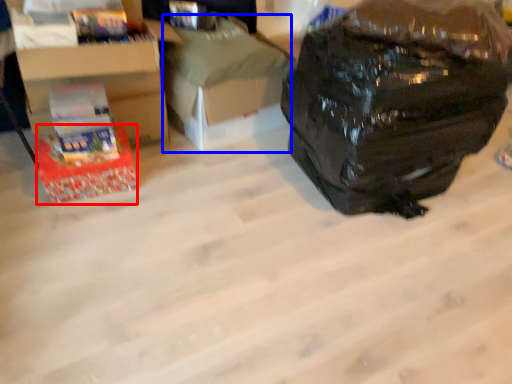
Question: Which point is closer to the camera, box (highlighted by a red box) or cardboard box (highlighted by a blue box)?

Choices:
 (A) box
 (B) cardboard box

Answer: (A)